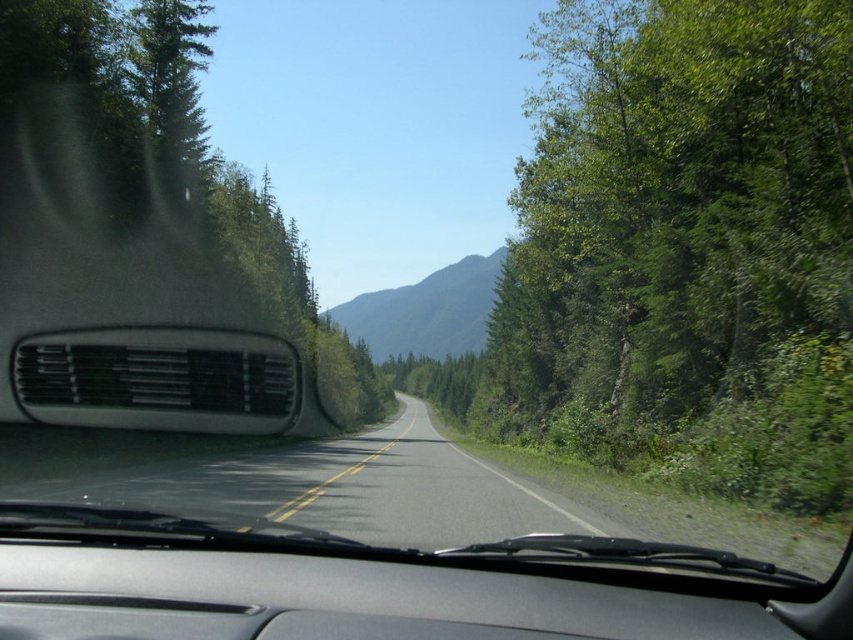
Question: Is green matte tree at left to the right of black asphalt road at center from the viewer's perspective?

Choices:
 (A) yes
 (B) no

Answer: (B)

Question: Among these objects, which one is nearest to the camera?

Choices:
 (A) green matte tree at left
 (B) green forested mountain at center
 (C) green leafy tree at right

Answer: (C)

Question: Can you confirm if green leafy tree at right is thinner than green matte tree at left?

Choices:
 (A) yes
 (B) no

Answer: (A)

Question: Which of the following is the farthest from the observer?

Choices:
 (A) green matte tree at left
 (B) green forested mountain at center
 (C) green leafy tree at right

Answer: (B)

Question: Which object appears closest to the camera in this image?

Choices:
 (A) green forested mountain at center
 (B) black asphalt road at center
 (C) green matte tree at left

Answer: (B)

Question: Where is black asphalt road at center located in relation to green forested mountain at center in the image?

Choices:
 (A) below
 (B) above

Answer: (A)